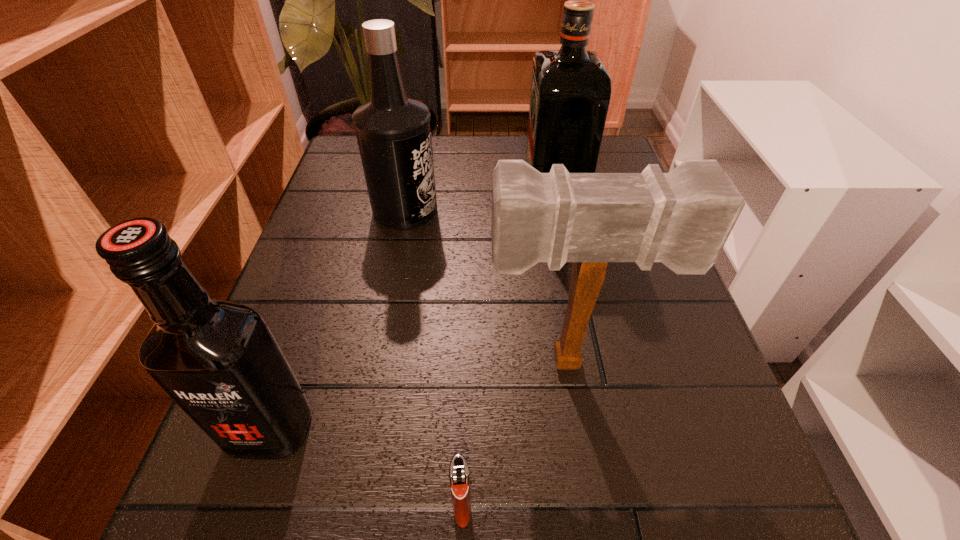
Where is `object that is the fourth closest to the rightmost liquor`? The width and height of the screenshot is (960, 540). object that is the fourth closest to the rightmost liquor is located at coordinates (459, 478).

Locate which object is the fourth closest to the rightmost liquor. Please provide its 2D coordinates. Your answer should be formatted as a tuple, i.e. [(x, y)], where the tuple contains the x and y coordinates of a point satisfying the conditions above.

[(459, 478)]

Where is `liquor that stands as the second closest to the second object from left to right`? liquor that stands as the second closest to the second object from left to right is located at coordinates (220, 363).

The width and height of the screenshot is (960, 540). I want to click on liquor that stands as the closest to the fourth farthest object, so click(x=393, y=131).

You are a GUI agent. You are given a task and a screenshot of the screen. Output one action in this format:
    pyautogui.click(x=<x>, y=<y>)
    Task: Click on the free space that satisfies the following two spatial constraints: 1. on the front label of the third nearest object; 2. on the left side of the second liquor from right to left
    The width and height of the screenshot is (960, 540).
    Given the screenshot: What is the action you would take?
    pyautogui.click(x=376, y=362)

This screenshot has width=960, height=540. I want to click on vacant space that satisfies the following two spatial constraints: 1. on the front label of the fourth object from right to left; 2. on the left side of the mallet, so click(x=376, y=362).

Identify the location of free space that satisfies the following two spatial constraints: 1. on the front label of the fourth object from right to left; 2. on the front-facing side of the leftmost liquor. The height and width of the screenshot is (540, 960). (363, 430).

Identify the location of vacant region that satisfies the following two spatial constraints: 1. on the back side of the mallet; 2. on the front label of the second object from left to right. This screenshot has height=540, width=960. (544, 210).

Where is `free space that satisfies the following two spatial constraints: 1. on the front label of the rightmost liquor; 2. on the front-facing side of the second nearest object`? free space that satisfies the following two spatial constraints: 1. on the front label of the rightmost liquor; 2. on the front-facing side of the second nearest object is located at coordinates (595, 430).